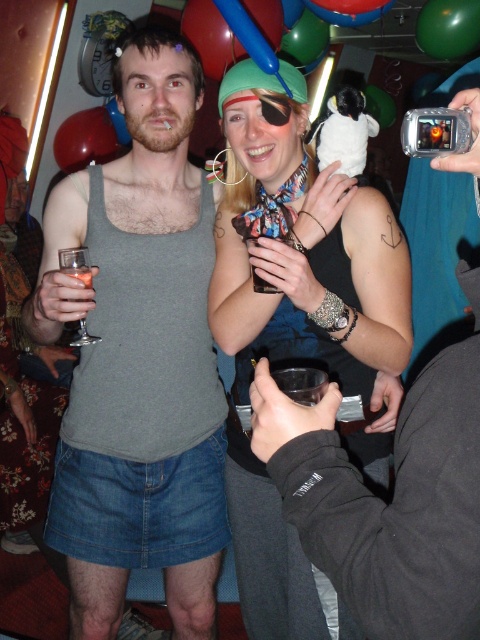
Is green rubber balloon at upper right taller than red rubber balloon at upper left?

In fact, green rubber balloon at upper right may be shorter than red rubber balloon at upper left.

The width and height of the screenshot is (480, 640). I want to click on green rubber balloon at upper right, so click(x=447, y=28).

The image size is (480, 640). What are the coordinates of `green rubber balloon at upper right` in the screenshot? It's located at (447, 28).

Who is more distant from viewer, (81, 113) or (265, 284)?

The point (81, 113) is more distant.

Is the position of red rubber balloon at upper left more distant than that of translucent plastic cup at center?

Yes, red rubber balloon at upper left is behind translucent plastic cup at center.

Is point (112, 148) farther from camera compared to point (269, 291)?

That is True.

The width and height of the screenshot is (480, 640). I want to click on red rubber balloon at upper left, so click(x=85, y=140).

Is clear glass wine glass at left below clear plastic cup at left?

Yes.

Which is in front, point (79, 342) or point (76, 298)?

Point (79, 342) is in front.

Is point (83, 266) more distant than point (74, 268)?

Yes.

The height and width of the screenshot is (640, 480). What are the coordinates of `clear glass wine glass at left` in the screenshot? It's located at (75, 262).